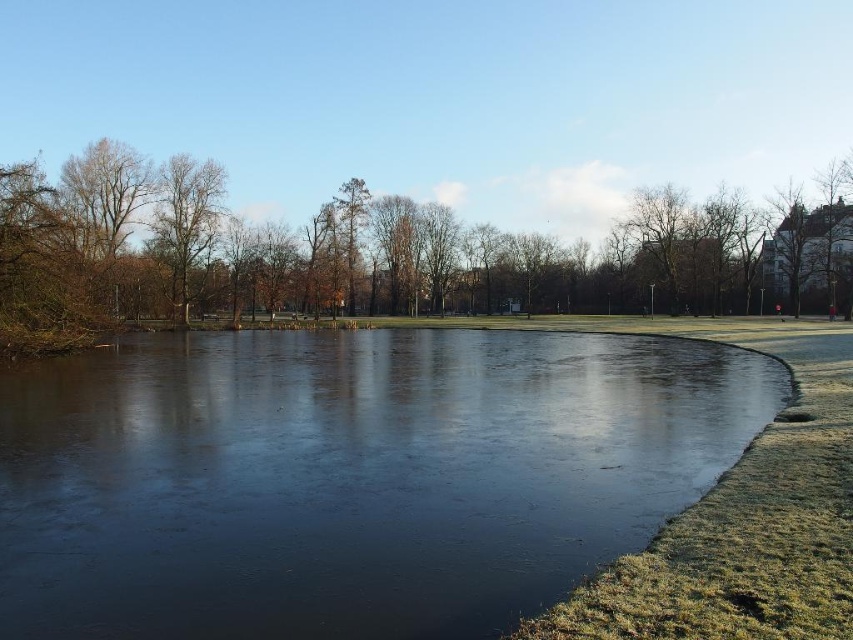
Question: Which point is closer to the camera taking this photo?

Choices:
 (A) (207, 173)
 (B) (521, 276)

Answer: (A)

Question: Observing the image, what is the correct spatial positioning of transparent ice at center in reference to bare wood tree at upper left?

Choices:
 (A) left
 (B) right

Answer: (B)

Question: Can you confirm if transparent ice at center is thinner than brown leafless tree at upper left?

Choices:
 (A) yes
 (B) no

Answer: (A)

Question: Which of these objects is positioned farthest from the bare wood tree at upper left?

Choices:
 (A) brown leafless tree at upper left
 (B) transparent ice at center

Answer: (B)

Question: Estimate the real-world distances between objects in this image. Which object is closer to the bare wood tree at upper left?

Choices:
 (A) transparent ice at center
 (B) brown leafless tree at upper left

Answer: (B)

Question: Can you confirm if brown leafless tree at upper left is positioned below bare wood tree at upper left?

Choices:
 (A) no
 (B) yes

Answer: (B)